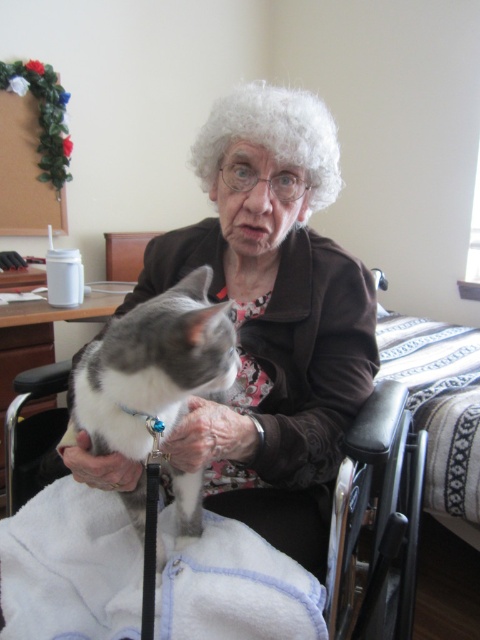
You are a fashion designer observing the elderly woman in the image. You need to determine if the matte brown jacket at center can be worn over the white curly wig at center without adjustments. Based on their widths, can the jacket accommodate the wig?

The matte brown jacket at center might be wider than white curly wig at center, so it is possible that the jacket can accommodate the wig without needing adjustments.

You are a caregiver entering the room and need to assist the elderly woman. The black plastic wheelchair at center and the white curly wig at center are both in your line of sight. Which object is positioned lower from the floor?

The black plastic wheelchair at center is positioned lower from the floor than the white curly wig at center.

You are a caregiver in the room. You need to move the matte brown jacket at center and the black plastic wheelchair at center to make space for a medical device. Which object should you move first to ensure the medical device can be placed between them?

The matte brown jacket at center is to the left of the black plastic wheelchair at center. To place the medical device between them, you should move the matte brown jacket at center first so there is space between the jacket and the wheelchair.